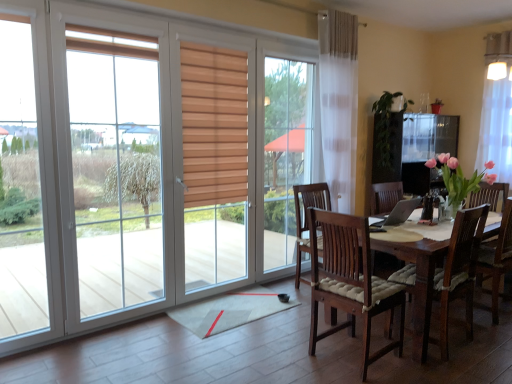
Describe the element at coordinates (496, 125) in the screenshot. The image size is (512, 384). I see `white sheer curtain at upper right` at that location.

You are a GUI agent. You are given a task and a screenshot of the screen. Output one action in this format:
    pyautogui.click(x=<x>, y=<y>)
    Task: Click on the white sheer curtain at upper right
    The width and height of the screenshot is (512, 384).
    Given the screenshot: What is the action you would take?
    pyautogui.click(x=496, y=125)

What is the approximate width of white sheer curtain at upper right?

It is 6.51 inches.

Describe the element at coordinates (397, 214) in the screenshot. I see `silver metallic laptop at center` at that location.

I want to click on silver metallic laptop at center, so click(397, 214).

The height and width of the screenshot is (384, 512). What are the coordinates of `white sheer curtain at upper right` in the screenshot? It's located at (496, 125).

Does silver metallic laptop at center appear on the left side of white sheer curtain at upper right?

Yes, silver metallic laptop at center is to the left of white sheer curtain at upper right.

Is the position of silver metallic laptop at center more distant than that of white sheer curtain at upper right?

No, it is not.

Is point (410, 210) positioned in front of point (504, 69)?

Yes, it is.

From the image's perspective, which one is positioned higher, silver metallic laptop at center or white sheer curtain at upper right?

white sheer curtain at upper right appears higher in the image.

From a real-world perspective, which is physically above, silver metallic laptop at center or white sheer curtain at upper right?

From a 3D spatial view, white sheer curtain at upper right is above.

Looking at this image, does silver metallic laptop at center have a greater width compared to white sheer curtain at upper right?

Yes.

Considering the sizes of silver metallic laptop at center and white sheer curtain at upper right in the image, is silver metallic laptop at center taller or shorter than white sheer curtain at upper right?

In the image, silver metallic laptop at center appears to be shorter than white sheer curtain at upper right.

Which of these two, silver metallic laptop at center or white sheer curtain at upper right, is smaller?

silver metallic laptop at center is smaller.

Looking at this image, is white sheer curtain at upper right surrounded by silver metallic laptop at center?

No, silver metallic laptop at center does not contain white sheer curtain at upper right.

Is silver metallic laptop at center positioned far away from white sheer curtain at upper right?

Indeed, silver metallic laptop at center is not near white sheer curtain at upper right.

Is white sheer curtain at upper right at the back of silver metallic laptop at center?

No, silver metallic laptop at center is not facing away from white sheer curtain at upper right.

Where is `laptop that is under the white sheer curtain at upper right (from a real-world perspective)`? laptop that is under the white sheer curtain at upper right (from a real-world perspective) is located at coordinates (397, 214).

Between white sheer curtain at upper right and silver metallic laptop at center, which one appears on the left side from the viewer's perspective?

From the viewer's perspective, silver metallic laptop at center appears more on the left side.

Which object is more forward, white sheer curtain at upper right or silver metallic laptop at center?

silver metallic laptop at center is more forward.

Is point (484, 149) positioned behind point (405, 215)?

Yes, it is.

From the image's perspective, is white sheer curtain at upper right located above or below silver metallic laptop at center?

white sheer curtain at upper right is situated higher than silver metallic laptop at center in the image.

From a real-world perspective, is white sheer curtain at upper right above or below silver metallic laptop at center?

From a real-world perspective, white sheer curtain at upper right is physically above silver metallic laptop at center.

Which of these two, white sheer curtain at upper right or silver metallic laptop at center, is thinner?

With smaller width is white sheer curtain at upper right.

In terms of height, does white sheer curtain at upper right look taller or shorter compared to silver metallic laptop at center?

Considering their sizes, white sheer curtain at upper right has more height than silver metallic laptop at center.

Who is smaller, white sheer curtain at upper right or silver metallic laptop at center?

With smaller size is silver metallic laptop at center.

Is white sheer curtain at upper right spatially inside silver metallic laptop at center, or outside of it?

white sheer curtain at upper right exists outside the volume of silver metallic laptop at center.

Is white sheer curtain at upper right in contact with silver metallic laptop at center?

No, white sheer curtain at upper right is not next to silver metallic laptop at center.

Could you tell me if white sheer curtain at upper right is facing silver metallic laptop at center?

Yes.

How different are the orientations of white sheer curtain at upper right and silver metallic laptop at center in degrees?

There is a 83.6-degree angle between the facing directions of white sheer curtain at upper right and silver metallic laptop at center.

Measure the distance from white sheer curtain at upper right to silver metallic laptop at center.

6.22 feet.

The image size is (512, 384). In order to click on curtain that appears above the silver metallic laptop at center (from the image's perspective) in this screenshot , I will do `click(496, 125)`.

Identify the location of curtain on the right of silver metallic laptop at center. Image resolution: width=512 pixels, height=384 pixels. (496, 125).

What are the coordinates of `laptop in front of the white sheer curtain at upper right` in the screenshot? It's located at pos(397,214).